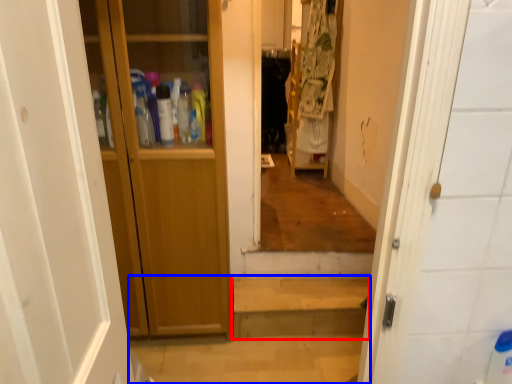
Question: Which object is closer to the camera taking this photo, stairwell (highlighted by a red box) or path (highlighted by a blue box)?

Choices:
 (A) stairwell
 (B) path

Answer: (B)